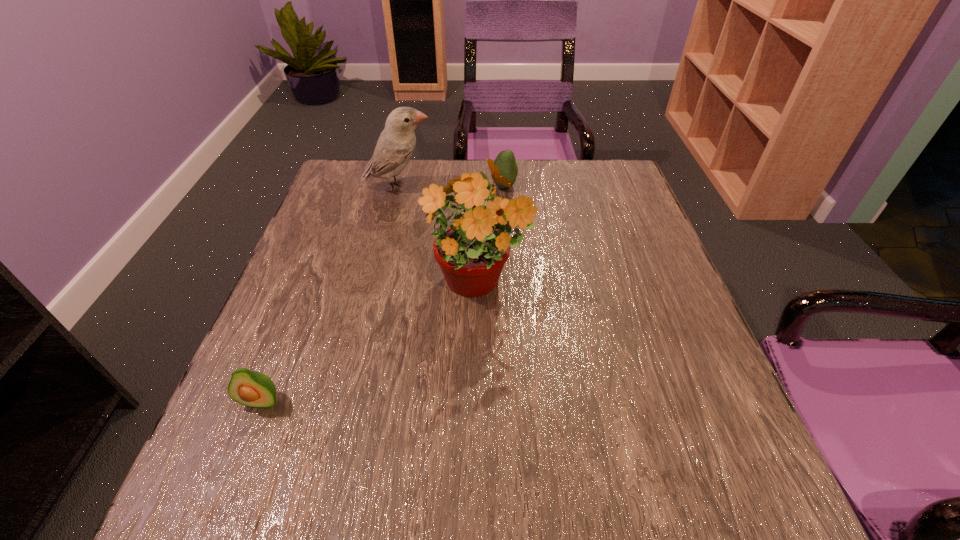
Locate an element on the screen. free space located on the cut side of the leftmost object is located at coordinates (237, 463).

The image size is (960, 540). In order to click on bird situated at the far edge in this screenshot , I will do (396, 144).

Identify the location of avocado at the far edge. (505, 160).

Identify the location of bird at the left edge. (396, 144).

Where is `avocado that is positioned at the left edge`? This screenshot has height=540, width=960. avocado that is positioned at the left edge is located at coordinates (250, 388).

The width and height of the screenshot is (960, 540). I want to click on object positioned at the far left corner, so click(x=396, y=144).

In the image, there is a desktop. Find the location of `vacant space at the far edge`. vacant space at the far edge is located at coordinates (424, 160).

Where is `vacant region at the near edge of the desktop`? The image size is (960, 540). vacant region at the near edge of the desktop is located at coordinates (322, 494).

This screenshot has width=960, height=540. I want to click on vacant area at the left edge of the desktop, so click(297, 378).

Where is `vacant space at the right edge of the desktop`? The width and height of the screenshot is (960, 540). vacant space at the right edge of the desktop is located at coordinates (612, 224).